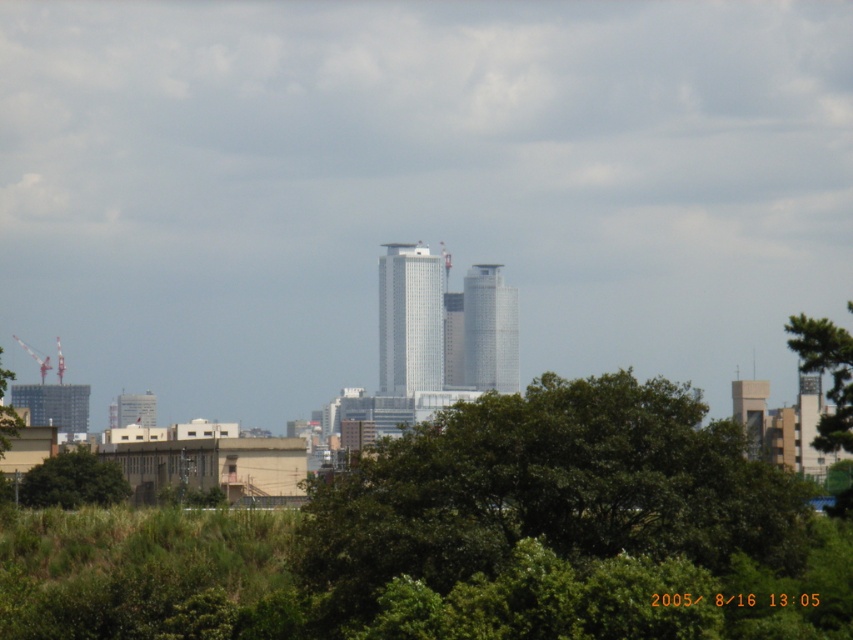
Does white glass building at center have a greater width compared to green leafy tree at lower left?

No, white glass building at center is not wider than green leafy tree at lower left.

Is point (425, 365) positioned after point (61, 484)?

Yes, it is.

Where is `white glass building at center`? white glass building at center is located at coordinates (409, 320).

Who is more forward, (701, 534) or (146, 419)?

Point (701, 534)

Can you confirm if green leafy tree at center is positioned to the right of gray concrete building at lower left?

Correct, you'll find green leafy tree at center to the right of gray concrete building at lower left.

Does point (614, 484) come closer to viewer compared to point (138, 419)?

Yes, point (614, 484) is in front of point (138, 419).

Find the location of a particular element. The width and height of the screenshot is (853, 640). green leafy tree at center is located at coordinates (548, 490).

Is green leafy tree at lower left taller than white glass building at upper center?

No.

Can you confirm if green leafy tree at lower left is wider than white glass building at upper center?

Answer: No.

Measure the distance between point (97, 477) and camera.

A distance of 571.39 meters exists between point (97, 477) and camera.

I want to click on green leafy tree at lower left, so click(73, 481).